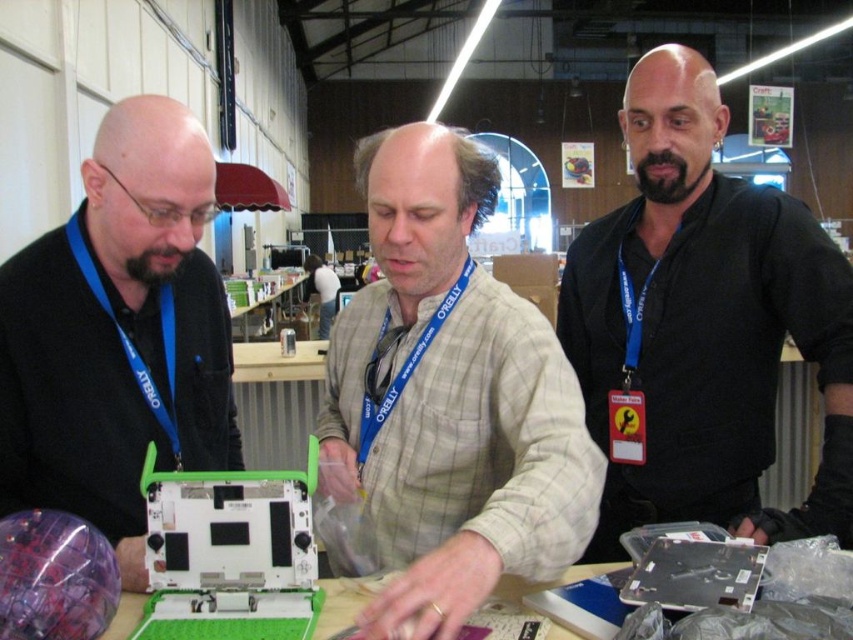
Which is behind, point (485, 326) or point (160, 481)?

Point (485, 326)

This screenshot has width=853, height=640. Describe the element at coordinates (450, 400) in the screenshot. I see `light brown plaid shirt at center` at that location.

Identify the location of light brown plaid shirt at center. The height and width of the screenshot is (640, 853). (450, 400).

Is white plastic laptop at center behind matte black laptop at center?

That is True.

Does white plastic laptop at center appear under matte black laptop at center?

Incorrect, white plastic laptop at center is not positioned below matte black laptop at center.

The width and height of the screenshot is (853, 640). Describe the element at coordinates (230, 554) in the screenshot. I see `white plastic laptop at center` at that location.

Locate an element on the screen. The height and width of the screenshot is (640, 853). white plastic laptop at center is located at coordinates (x=230, y=554).

Is black matte shirt at upper right shorter than matte black laptop at left?

No.

Does black matte shirt at upper right have a greater height compared to matte black laptop at left?

Yes, black matte shirt at upper right is taller than matte black laptop at left.

Which is in front, point (825, 509) or point (119, 147)?

Positioned in front is point (119, 147).

This screenshot has height=640, width=853. I want to click on black matte shirt at upper right, so click(704, 323).